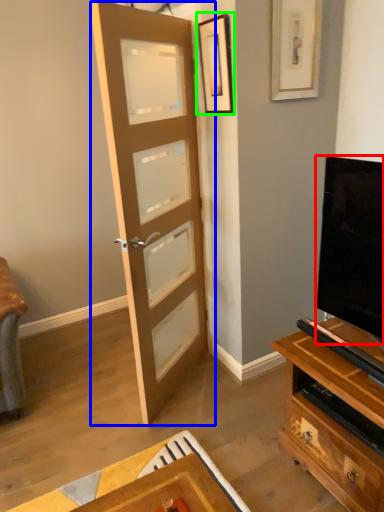
Question: Which is nearer to the television (highlighted by a red box)? door (highlighted by a blue box) or picture frame (highlighted by a green box).

Choices:
 (A) door
 (B) picture frame

Answer: (A)